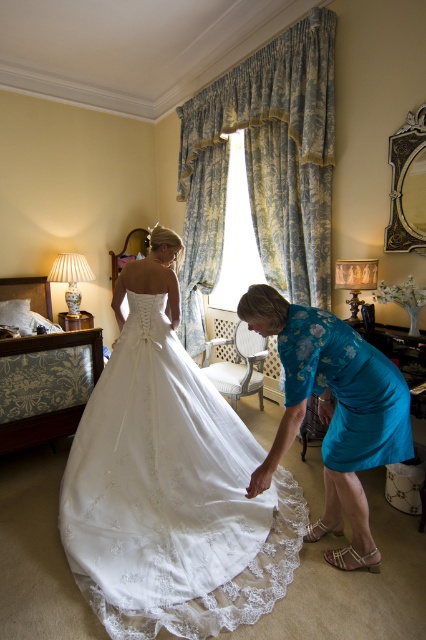
Does white lace dress at center appear under matte blue dress at lower right?

Correct, white lace dress at center is located below matte blue dress at lower right.

Does point (190, 625) come in front of point (383, 390)?

Yes, it is.

Does point (176, 529) come closer to viewer compared to point (324, 449)?

No, (176, 529) is behind (324, 449).

The image size is (426, 640). Find the location of `white lace dress at center`. white lace dress at center is located at coordinates (170, 483).

From the picture: Can you confirm if white lace dress at center is positioned below blue satin dress at lower center?

Correct, white lace dress at center is located below blue satin dress at lower center.

The height and width of the screenshot is (640, 426). I want to click on white lace dress at center, so click(170, 483).

Between point (250, 563) and point (351, 500), which one is positioned in front?

Point (351, 500) is in front.

Image resolution: width=426 pixels, height=640 pixels. What are the coordinates of `white lace dress at center` in the screenshot? It's located at (170, 483).

Who is taller, blue satin dress at lower center or matte blue dress at lower right?

blue satin dress at lower center is taller.

Between point (328, 435) and point (336, 349), which one is positioned in front?

Positioned in front is point (336, 349).

Does point (377, 381) come behind point (287, 392)?

Yes.

Find the location of a particular element. The height and width of the screenshot is (640, 426). blue satin dress at lower center is located at coordinates (333, 412).